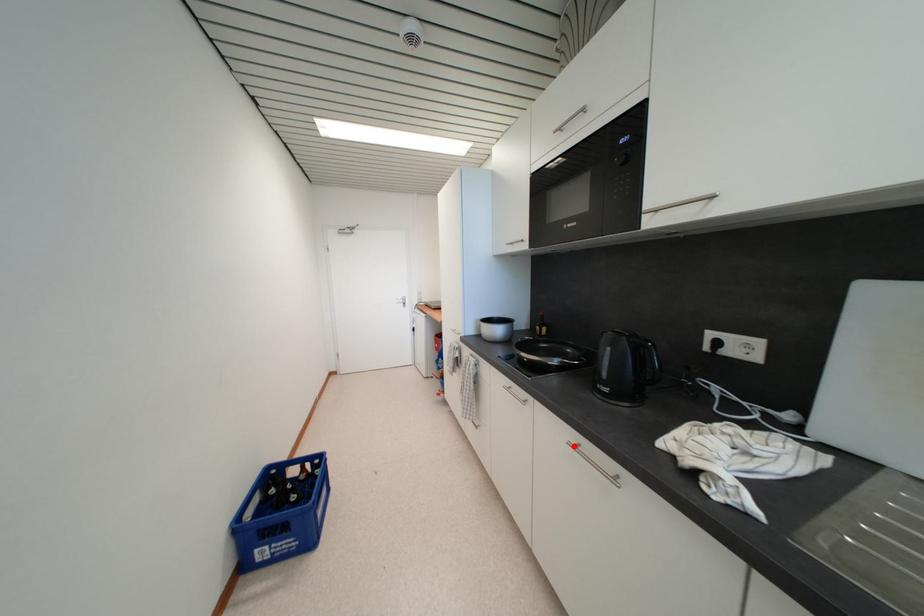
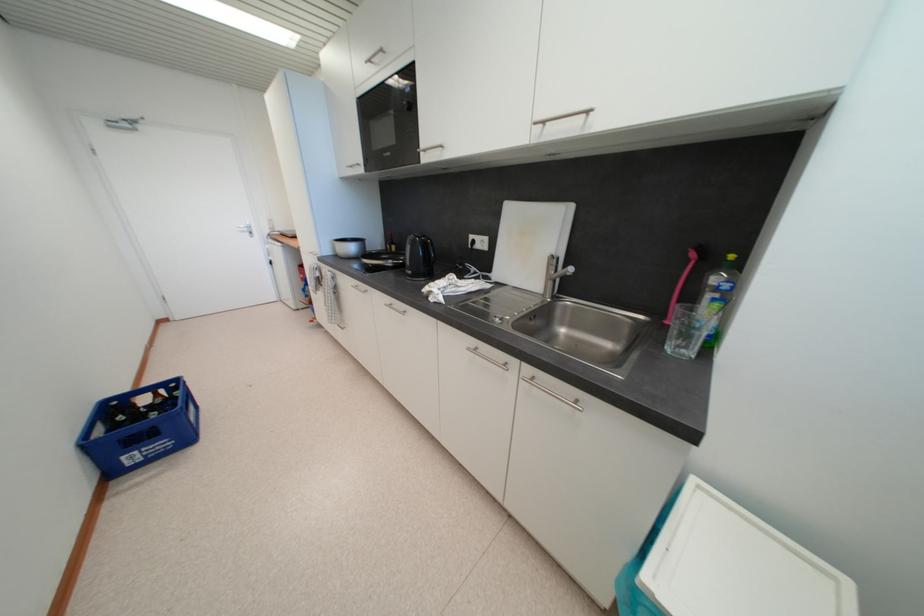
The point at the highlighted location is marked in the first image. Where is the corresponding point in the second image?

(391, 307)